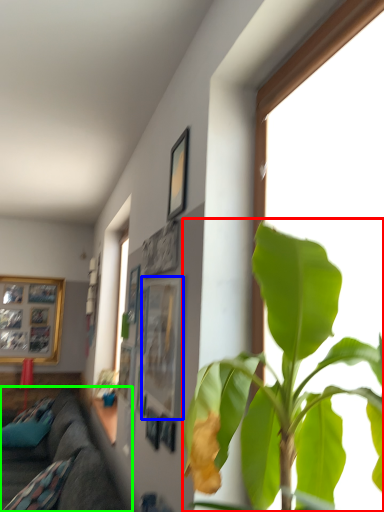
Question: Which is farther away from houseplant (highlighted by a red box)? picture frame (highlighted by a blue box) or studio couch (highlighted by a green box)?

Choices:
 (A) picture frame
 (B) studio couch

Answer: (B)